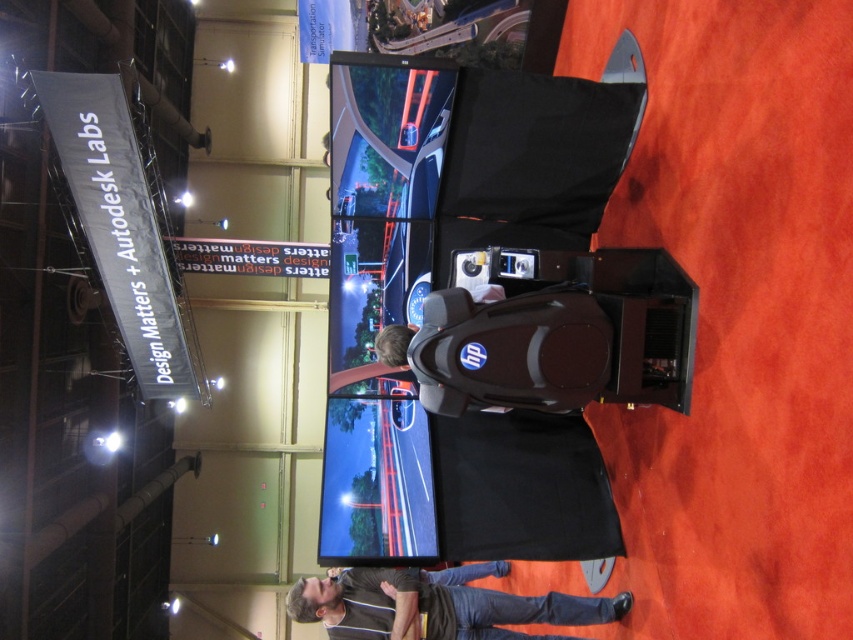
You are standing in the exhibition hall and want to sit down to try the VR setup. The VR setup is located at the large screen displaying a racing game environment. Where should you position yourself relative to the black plastic chair at center to access the VR setup?

To access the VR setup located at the large screen displaying a racing game environment, you should position yourself near the black plastic chair at center, as it is centrally located and likely positioned for optimal interaction with the setup.

You are a photographer at the event and need to set up a camera to capture both the black plastic chair at center and the dark gray shirt at center in the same shot. Since the camera is at eye level, will the chair be mostly visible above the shirt?

The black plastic chair at center has a greater height compared to dark gray shirt at center, so yes, the chair will be mostly visible above the shirt in the photo.